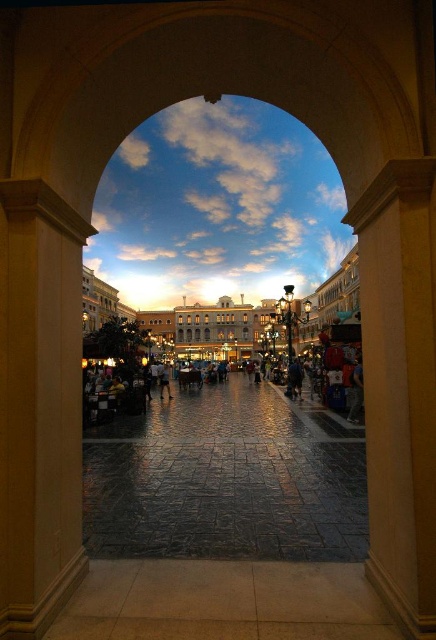
You are standing inside the archway and need to pass through to the plaza. There is a smooth beige column at left and dark blue jeans at center in your path. Which object is bigger and might block your way more?

The smooth beige column at left is larger in size than the dark blue jeans at center, so it might block your way more.

You are standing inside the archway and want to walk through to the plaza. There is a beige stone pillar at right and dark blue jeans at center in your way. Which object is narrower so you can navigate around it more easily?

The beige stone pillar at right has a lesser width compared to the dark blue jeans at center, so it is narrower and easier to navigate around.